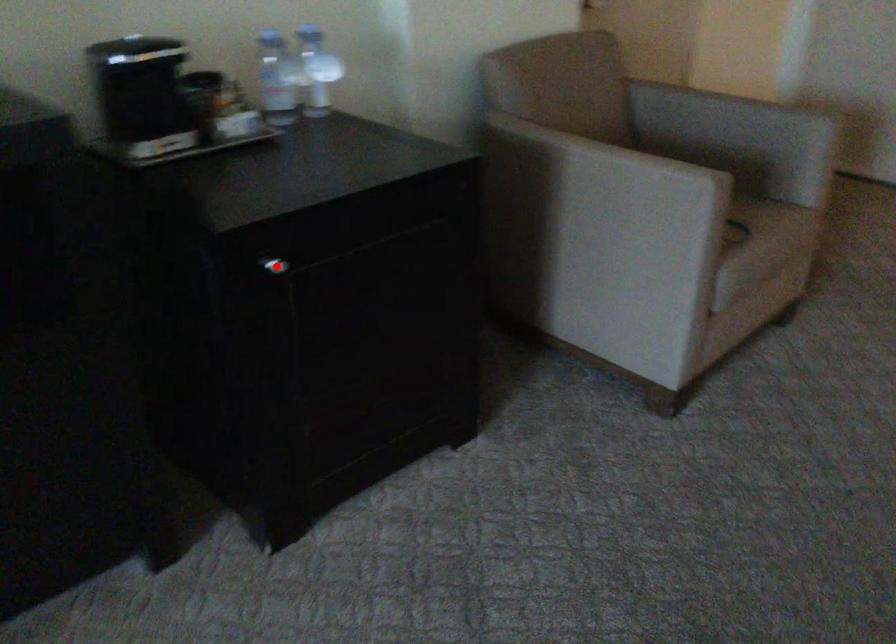
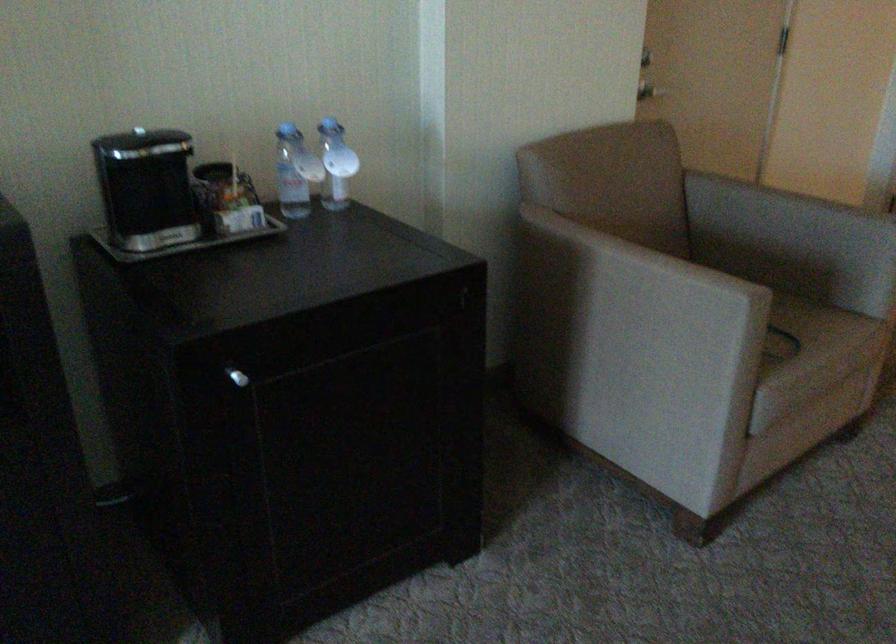
In the second image, find the point that corresponds to the highlighted location in the first image.

(237, 377)